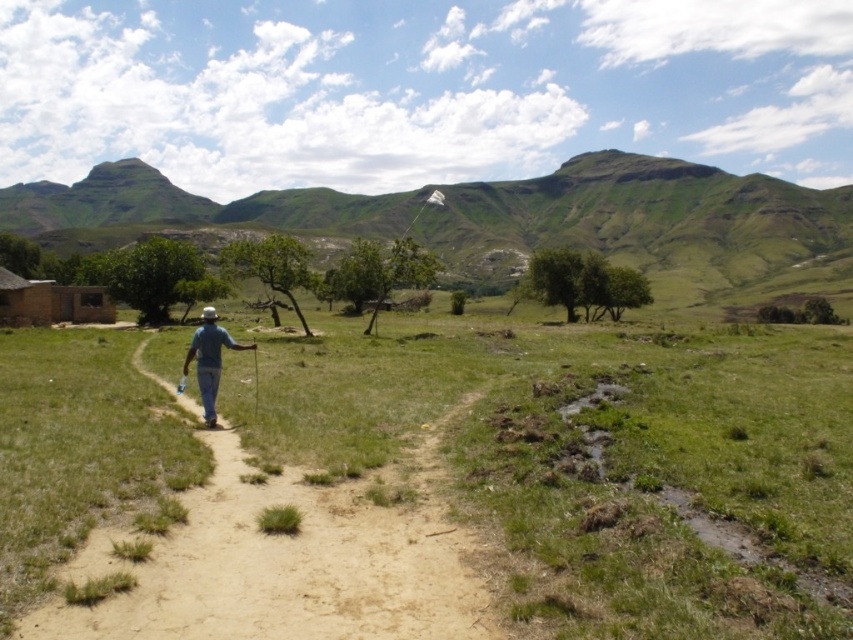
Does green grassy mountain at upper center lie in front of blue denim jeans at center?

No, it is not.

Which is in front, point (59, 193) or point (195, 356)?

Point (195, 356)

Find the location of a particular element. Image resolution: width=853 pixels, height=640 pixels. green grassy mountain at upper center is located at coordinates (489, 218).

Which is more to the right, green grassy at center or blue denim jeans at center?

green grassy at center

Between green grassy at center and blue denim jeans at center, which one is positioned higher?

blue denim jeans at center

This screenshot has width=853, height=640. Find the location of `green grassy at center`. green grassy at center is located at coordinates (444, 483).

Is green grassy at center to the left of green grassy mountain at upper center from the viewer's perspective?

In fact, green grassy at center is to the right of green grassy mountain at upper center.

Between point (117, 344) and point (653, 212), which one is positioned in front?

Point (117, 344) is more forward.

Who is more forward, (698, 612) or (634, 221)?

Positioned in front is point (698, 612).

Identify the location of green grassy at center. (444, 483).